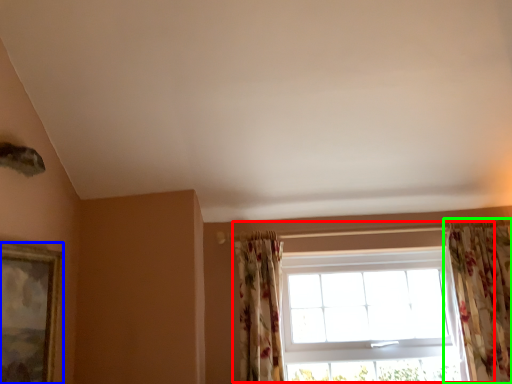
Question: Which object is positioned closest to window (highlighted by a red box)? Select from picture frame (highlighted by a blue box) and curtain (highlighted by a green box).

Choices:
 (A) picture frame
 (B) curtain

Answer: (B)